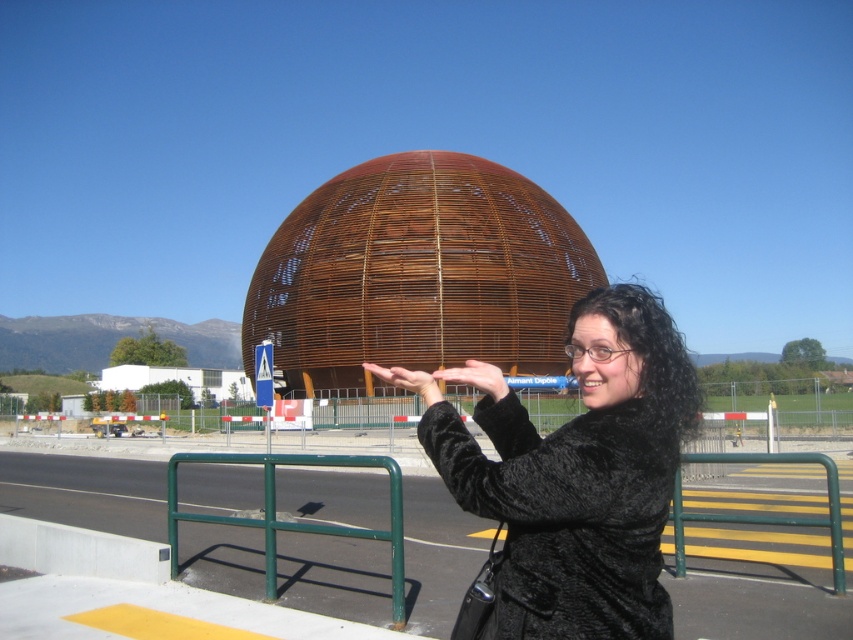
Question: Which object is closer to the camera taking this photo?

Choices:
 (A) rustic wood dome at center
 (B) black fur coat at center

Answer: (B)

Question: Observing the image, what is the correct spatial positioning of rustic wood dome at center in reference to black fur coat at center?

Choices:
 (A) above
 (B) below

Answer: (A)

Question: Can you confirm if rustic wood dome at center is positioned to the right of black fur coat at center?

Choices:
 (A) no
 (B) yes

Answer: (A)

Question: Considering the relative positions of rustic wood dome at center and black fur coat at center in the image provided, where is rustic wood dome at center located with respect to black fur coat at center?

Choices:
 (A) left
 (B) right

Answer: (A)